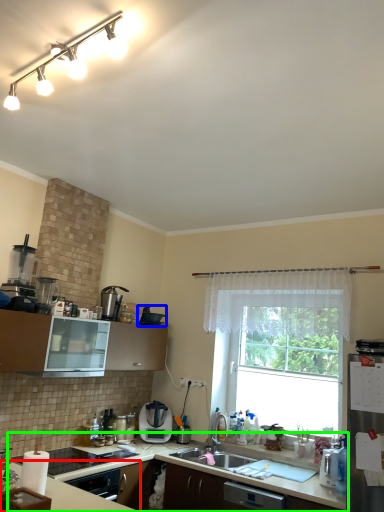
Question: Which object is positioned farthest from countertop (highlighted by a red box)? Select from appliance (highlighted by a blue box) and countertop (highlighted by a green box).

Choices:
 (A) appliance
 (B) countertop

Answer: (A)